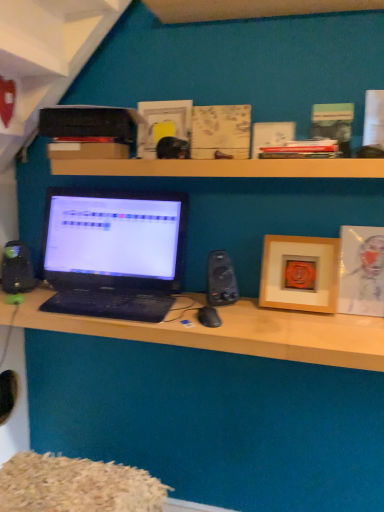
Question: Is point (148, 325) closer or farther from the camera than point (347, 269)?

Choices:
 (A) closer
 (B) farther

Answer: (A)

Question: Considering the relative positions of matte black laptop at center and matte wooden picture frame at right, arranged as the first picture frame when viewed from the right, in the image provided, is matte black laptop at center to the left or to the right of matte wooden picture frame at right, arranged as the first picture frame when viewed from the right,?

Choices:
 (A) left
 (B) right

Answer: (A)

Question: Which object is positioned closest to the matte black laptop at center?

Choices:
 (A) wooden at upper center
 (B) black textured keyboard at center
 (C) black plastic speaker at left, acting as the first speaker starting from the left
 (D) matte wooden picture frame at right, which is counted as the second picture frame, starting from the left
 (E) matte black laptop at center

Answer: (B)

Question: Estimate the real-world distances between objects in this image. Which object is closer to the matte black laptop at center?

Choices:
 (A) black plastic speaker at left, which appears as the 2th speaker when viewed from the right
 (B) matte wooden picture frame at right, which is counted as the second picture frame, starting from the left
 (C) black matte mouse at center
 (D) matte black laptop at center
 (E) black plastic speaker at center-right, the second speaker in the left-to-right sequence

Answer: (D)